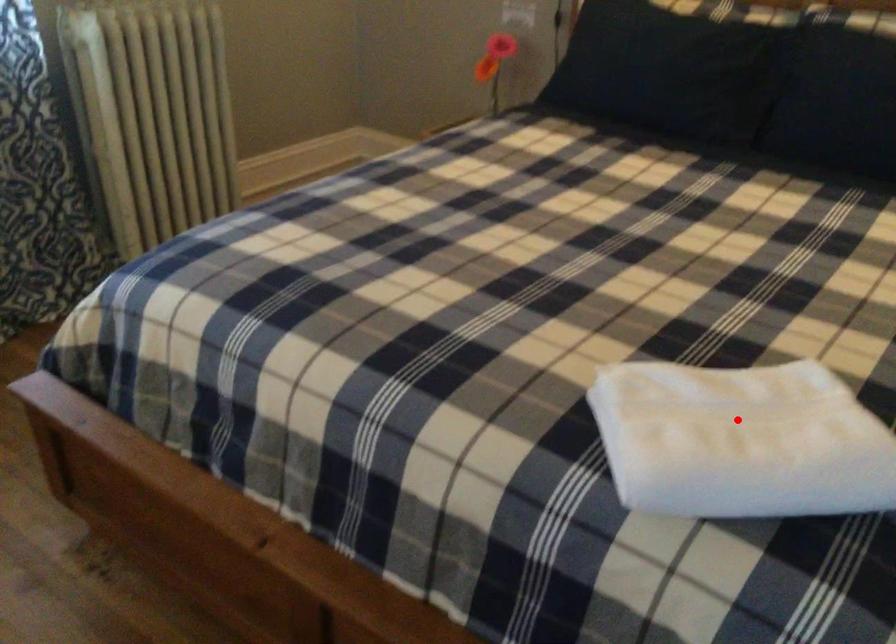
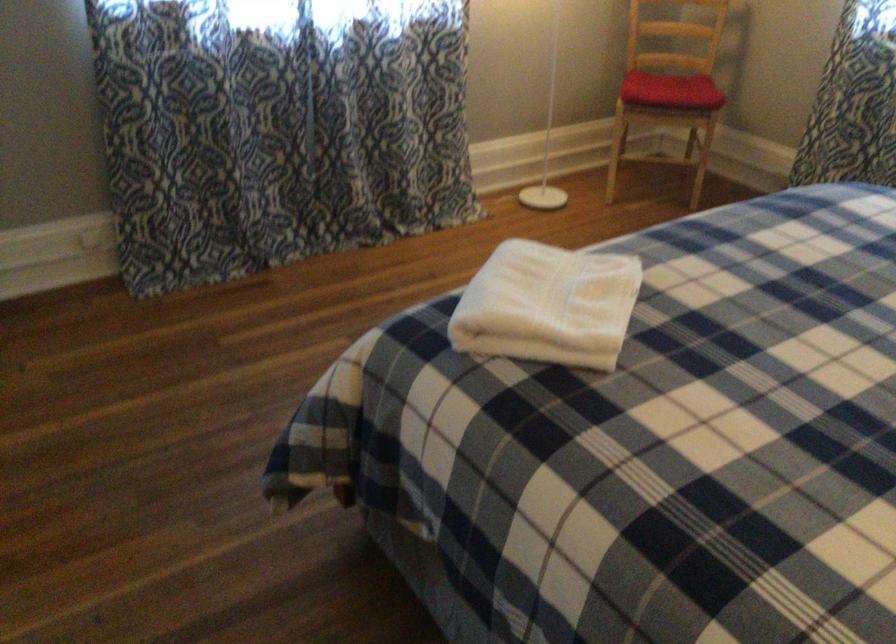
Question: I am providing you with two images of the same scene from different viewpoints. A red point is shown in image1. For the corresponding object point in image2, is it positioned nearer or farther from the camera?

Choices:
 (A) Nearer
 (B) Farther

Answer: (B)